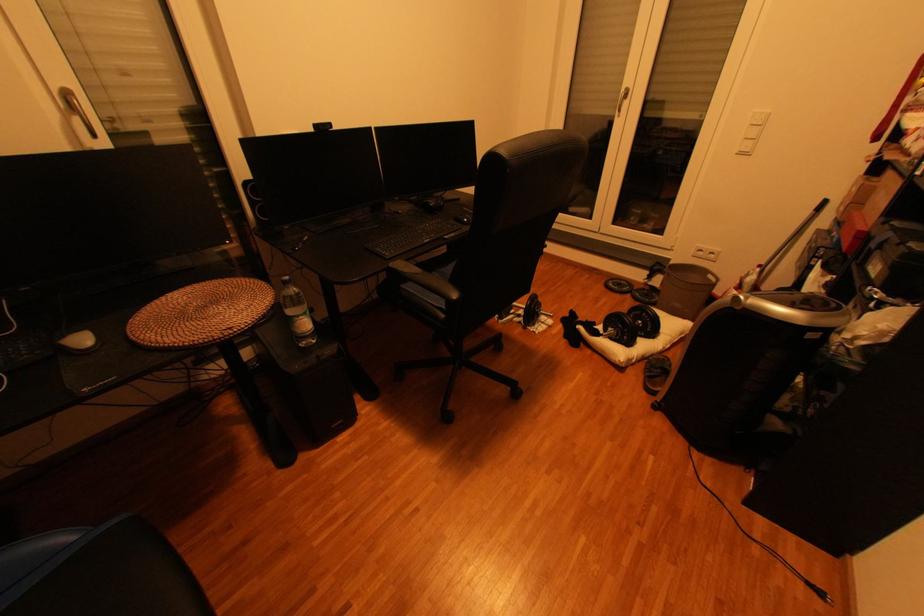
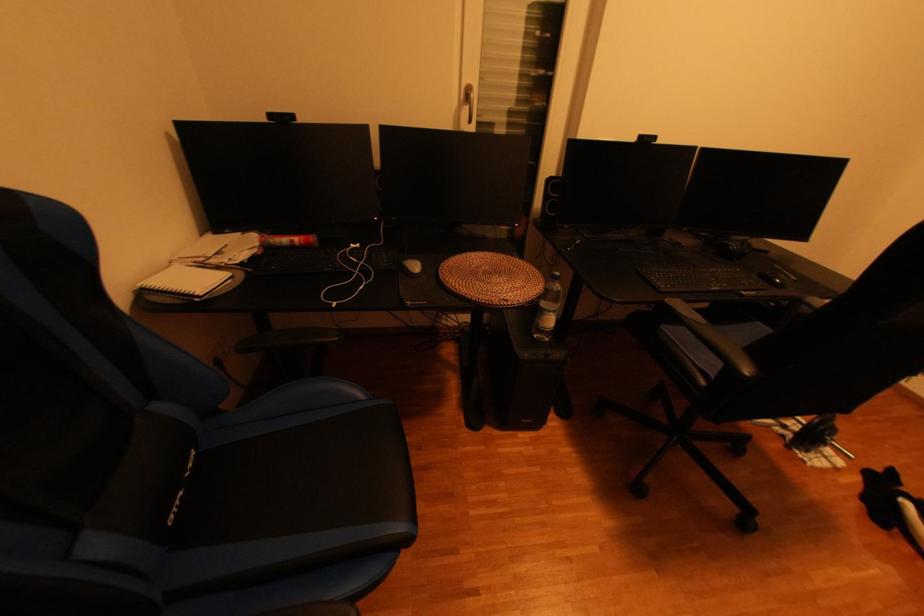
The point at (275, 305) is marked in the first image. Where is the corresponding point in the second image?

(546, 293)